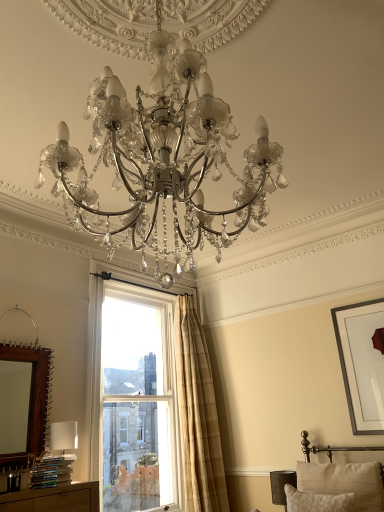
Question: Can you confirm if beige plaid curtain at upper right is bigger than brown wooden mirror at left?

Choices:
 (A) yes
 (B) no

Answer: (A)

Question: Is beige plaid curtain at upper right oriented away from brown wooden mirror at left?

Choices:
 (A) no
 (B) yes

Answer: (A)

Question: From the image's perspective, is beige plaid curtain at upper right beneath brown wooden mirror at left?

Choices:
 (A) yes
 (B) no

Answer: (A)

Question: Is beige plaid curtain at upper right surrounding brown wooden mirror at left?

Choices:
 (A) no
 (B) yes

Answer: (A)

Question: From a real-world perspective, is beige plaid curtain at upper right beneath brown wooden mirror at left?

Choices:
 (A) yes
 (B) no

Answer: (A)

Question: Relative to beige textured pillow at lower right, which ranks as the 1th pillow in back-to-front order, is matte silver chandelier at center in front or behind?

Choices:
 (A) behind
 (B) front

Answer: (B)

Question: Does point (139, 39) appear closer or farther from the camera than point (316, 478)?

Choices:
 (A) closer
 (B) farther

Answer: (A)

Question: Considering the positions of matte silver chandelier at center and beige textured pillow at lower right, which ranks as the 1th pillow in back-to-front order, in the image, is matte silver chandelier at center bigger or smaller than beige textured pillow at lower right, which ranks as the 1th pillow in back-to-front order,?

Choices:
 (A) small
 (B) big

Answer: (B)

Question: Would you say matte silver chandelier at center is inside or outside beige textured pillow at lower right, which ranks as the 1th pillow in back-to-front order?

Choices:
 (A) inside
 (B) outside

Answer: (B)

Question: Considering the positions of point (278, 480) and point (150, 411), is point (278, 480) closer or farther from the camera than point (150, 411)?

Choices:
 (A) closer
 (B) farther

Answer: (A)

Question: From the image's perspective, relative to clear glass window at center, is dark gray fabric lampshade at lower right above or below?

Choices:
 (A) above
 (B) below

Answer: (B)

Question: From a real-world perspective, is dark gray fabric lampshade at lower right positioned above or below clear glass window at center?

Choices:
 (A) below
 (B) above

Answer: (A)

Question: Do you think dark gray fabric lampshade at lower right is within clear glass window at center, or outside of it?

Choices:
 (A) inside
 (B) outside

Answer: (B)

Question: Would you say dark gray fabric lampshade at lower right is to the left or to the right of beige textured pillow at lower right, the second pillow when ordered from front to back, in the picture?

Choices:
 (A) right
 (B) left

Answer: (B)

Question: Is dark gray fabric lampshade at lower right situated inside beige textured pillow at lower right, the second pillow when ordered from front to back, or outside?

Choices:
 (A) inside
 (B) outside

Answer: (B)